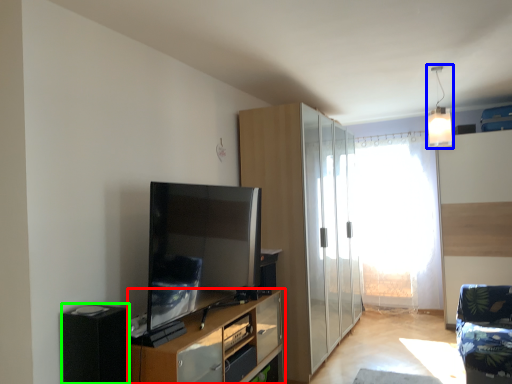
Question: Estimate the real-world distances between objects in this image. Which object is farther from cupboard (highlighted by a red box), light fixture (highlighted by a blue box) or appliance (highlighted by a green box)?

Choices:
 (A) light fixture
 (B) appliance

Answer: (A)